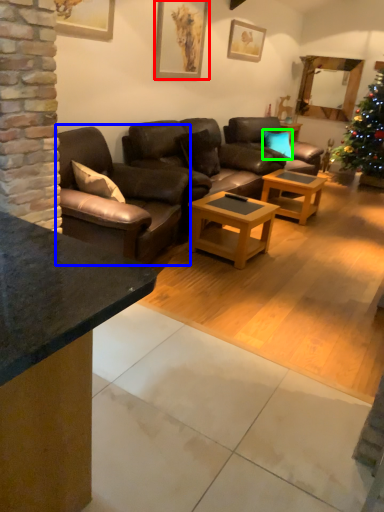
Question: Estimate the real-world distances between objects in this image. Which object is closer to picture frame (highlighted by a red box), studio couch (highlighted by a blue box) or pillow (highlighted by a green box)?

Choices:
 (A) studio couch
 (B) pillow

Answer: (A)